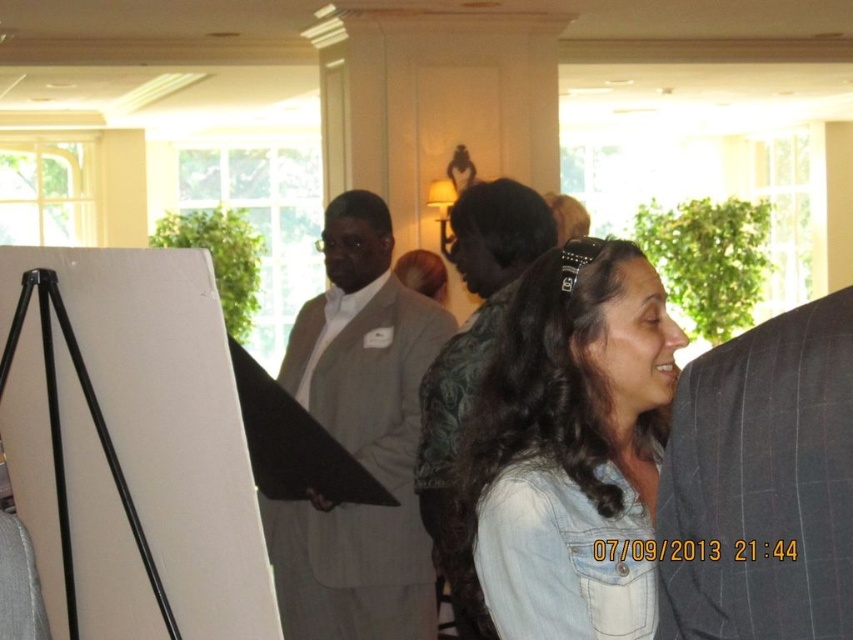
You are standing at the entrance of the room and want to approach the person wearing the denim shirt at center. According to the coordinates provided, in which direction should you move relative to your current position?

The denim shirt at center is located at coordinates point (572, 445). Since the coordinate system is not specified, it is difficult to determine the exact direction. However, if we assume standard image coordinates where the origin is at the top left corner, moving towards the bottom right would generally align with higher x and y values. Therefore, you should move diagonally towards the bottom right from your current position at the entrance.

You are a photographer at a formal event and need to capture a group photo of the dark gray pinstripe suit at right and gray suit at center. The camera has a maximum focus range of 2 meters. Can you fit both subjects within the camera frame without moving either of them?

The dark gray pinstripe suit at right and gray suit at center are 2.16 meters apart, which exceeds the camera maximum focus range of 2 meters. Therefore, you cannot fit both subjects within the camera frame without moving them.

You are organizing a photo shoot and need to position a model wearing the dark gray suit at center in front of the black matte easel at left. Given their sizes, will the model fit entirely within the width of the easel?

The black matte easel at left is wider than the dark gray suit at center, so the model wearing the dark gray suit at center can fit entirely within the width of the easel.